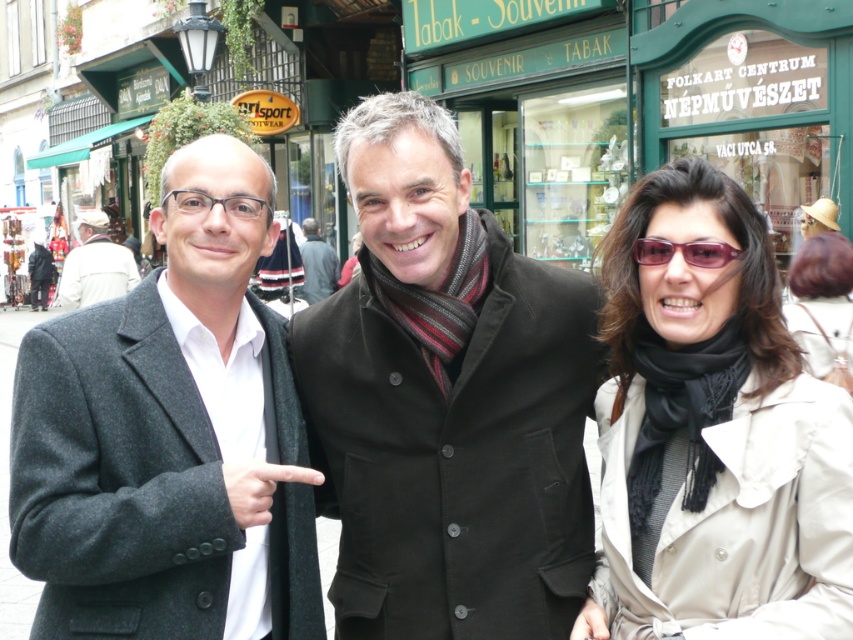
Is beige fabric coat at center positioned in front of purple acetate sunglasses at center?

Yes, beige fabric coat at center is in front of purple acetate sunglasses at center.

From the picture: Does beige fabric coat at center have a smaller size compared to purple acetate sunglasses at center?

Incorrect, beige fabric coat at center is not smaller in size than purple acetate sunglasses at center.

Which is behind, point (759, 380) or point (635, 248)?

The point (635, 248) is behind.

Find the location of a particular element. beige fabric coat at center is located at coordinates (714, 435).

Can you confirm if dark brown wool coat at center is taller than fuzzy gray hand at lower right?

Correct, dark brown wool coat at center is much taller as fuzzy gray hand at lower right.

Does dark brown wool coat at center have a lesser width compared to fuzzy gray hand at lower right?

No, dark brown wool coat at center is not thinner than fuzzy gray hand at lower right.

You are a GUI agent. You are given a task and a screenshot of the screen. Output one action in this format:
    pyautogui.click(x=<x>, y=<y>)
    Task: Click on the dark brown wool coat at center
    
    Given the screenshot: What is the action you would take?
    pyautogui.click(x=445, y=401)

Where is `dark brown wool coat at center`? This screenshot has height=640, width=853. dark brown wool coat at center is located at coordinates (445, 401).

Is denim jacket at center below matte black glasses at left?

No.

Looking at this image, which of these two, denim jacket at center or matte black glasses at left, stands taller?

denim jacket at center

Is point (299, 248) closer to camera compared to point (189, 202)?

No, it is not.

This screenshot has height=640, width=853. Identify the location of denim jacket at center. (317, 262).